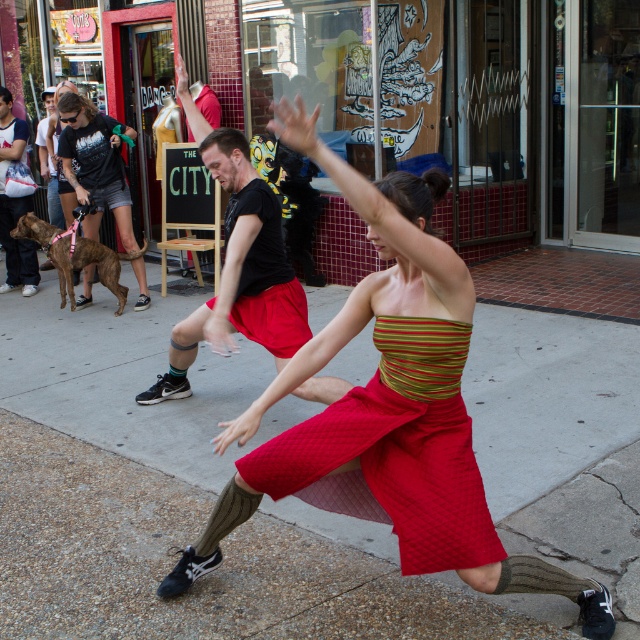
From the picture: You are a photographer trying to capture the dancer in the foreground wearing the vibrant red quilted skirt. You notice two points marked in the scene at coordinates point (x=321, y=476) and point (x=99, y=180). Which point should you focus on to ensure the dancer is in focus?

You should focus on point (x=321, y=476) because it is in front of point (x=99, y=180), and closer to the dancer wearing the vibrant red quilted skirt.